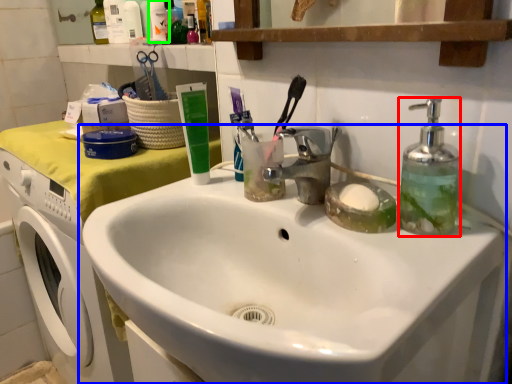
Question: Which object is positioned closest to soap dispenser (highlighted by a red box)? Select from sink (highlighted by a blue box) and toiletry (highlighted by a green box).

Choices:
 (A) sink
 (B) toiletry

Answer: (A)